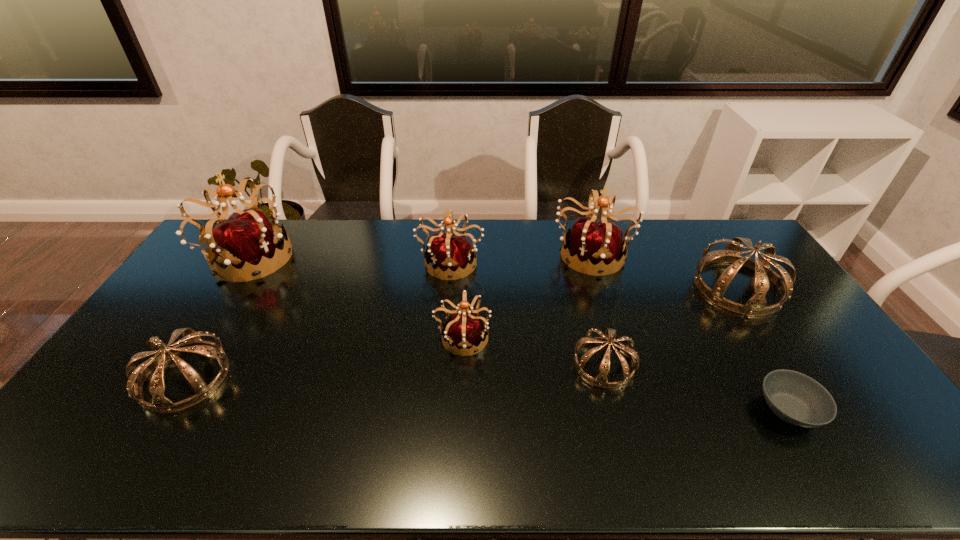
Locate which object is the fourth closest to the leftmost brown tiara. Please provide its 2D coordinates. Your answer should be formatted as a tuple, i.e. [(x, y)], where the tuple contains the x and y coordinates of a point satisfying the conditions above.

[(608, 337)]

Where is `tiara that stands as the third closest to the rightmost tiara`? The height and width of the screenshot is (540, 960). tiara that stands as the third closest to the rightmost tiara is located at coordinates (464, 329).

In order to click on tiara that is the closest one to the leftmost brown tiara in this screenshot , I will do `click(245, 243)`.

Identify which red tiara is the third closest to the biggest brown tiara. Please provide its 2D coordinates. Your answer should be formatted as a tuple, i.e. [(x, y)], where the tuple contains the x and y coordinates of a point satisfying the conditions above.

[(453, 254)]

Choose which red tiara is the nearest neighbor to the smallest red tiara. Please provide its 2D coordinates. Your answer should be formatted as a tuple, i.e. [(x, y)], where the tuple contains the x and y coordinates of a point satisfying the conditions above.

[(453, 254)]

Locate an element on the screen. brown tiara that is the second closest to the farthest brown tiara is located at coordinates (193, 343).

Locate which brown tiara is the third closest to the nearest red tiara. Please provide its 2D coordinates. Your answer should be formatted as a tuple, i.e. [(x, y)], where the tuple contains the x and y coordinates of a point satisfying the conditions above.

[(755, 306)]

Where is `vacant space that satisfies the following two spatial constraints: 1. on the front-facing side of the nearest red tiara; 2. on the back side of the shortest object`? The width and height of the screenshot is (960, 540). vacant space that satisfies the following two spatial constraints: 1. on the front-facing side of the nearest red tiara; 2. on the back side of the shortest object is located at coordinates (460, 409).

The height and width of the screenshot is (540, 960). Identify the location of free space in the image that satisfies the following two spatial constraints: 1. on the front-facing side of the shortest tiara; 2. on the right side of the third biggest red tiara. (443, 364).

Where is `blank space that satisfies the following two spatial constraints: 1. on the front-facing side of the farthest brown tiara; 2. on the right side of the second smallest red tiara`? The height and width of the screenshot is (540, 960). blank space that satisfies the following two spatial constraints: 1. on the front-facing side of the farthest brown tiara; 2. on the right side of the second smallest red tiara is located at coordinates (448, 287).